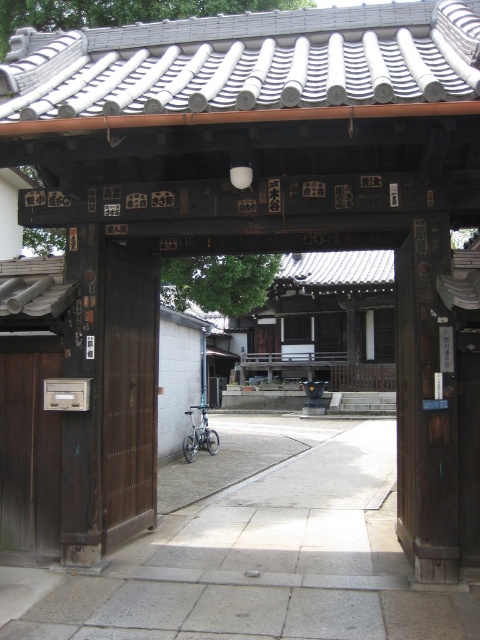
You are a tourist visiting a traditional Japanese temple and want to enter the main hall. You see a brown wooden door at center and a dark brown wood door at left. Which door should you go through to reach the main hall?

The dark brown wood door at left is behind the brown wooden door at center, so you should go through the brown wooden door at center first to reach the main hall.

You are visiting a traditional Japanese shrine and need to enter through the gate. You see a gray concrete pavement at center and a dark brown wood door at left. Which direction should you walk to reach the door?

You should walk towards the left from the gray concrete pavement at center to reach the dark brown wood door at left since it is positioned in front of the door.